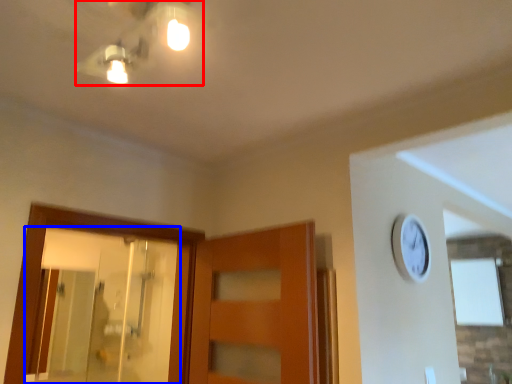
Question: Among these objects, which one is nearest to the camera, light fixture (highlighted by a red box) or mirror (highlighted by a blue box)?

Choices:
 (A) light fixture
 (B) mirror

Answer: (A)